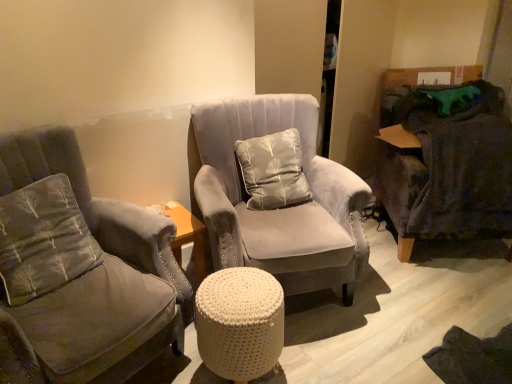
Question: In terms of height, does dark gray fabric swivel chair at right look taller or shorter compared to light gray fabric pillow at center, which is the 2th pillow from left to right?

Choices:
 (A) tall
 (B) short

Answer: (A)

Question: From a real-world perspective, is dark gray fabric swivel chair at right physically located above or below light gray fabric pillow at center, arranged as the second pillow when viewed from the front?

Choices:
 (A) above
 (B) below

Answer: (B)

Question: Which of these objects is positioned closest to the velvet gray armchair at left, which is the 1th chair in left-to-right order?

Choices:
 (A) gray fabric pillow at left, the first pillow viewed from the left
 (B) suede gray chair at center, the second chair when ordered from left to right
 (C) dark gray fabric swivel chair at right
 (D) light gray fabric pillow at center, which is the first pillow from back to front
 (E) white knitted pouf at center

Answer: (A)

Question: Which object is the farthest from the light gray fabric pillow at center, which is the 2th pillow from left to right?

Choices:
 (A) velvet gray armchair at left, arranged as the 2th chair when viewed from the right
 (B) gray fabric pillow at left, the first pillow viewed from the left
 (C) white knitted pouf at center
 (D) suede gray chair at center, the second chair when ordered from left to right
 (E) dark gray fabric swivel chair at right

Answer: (B)